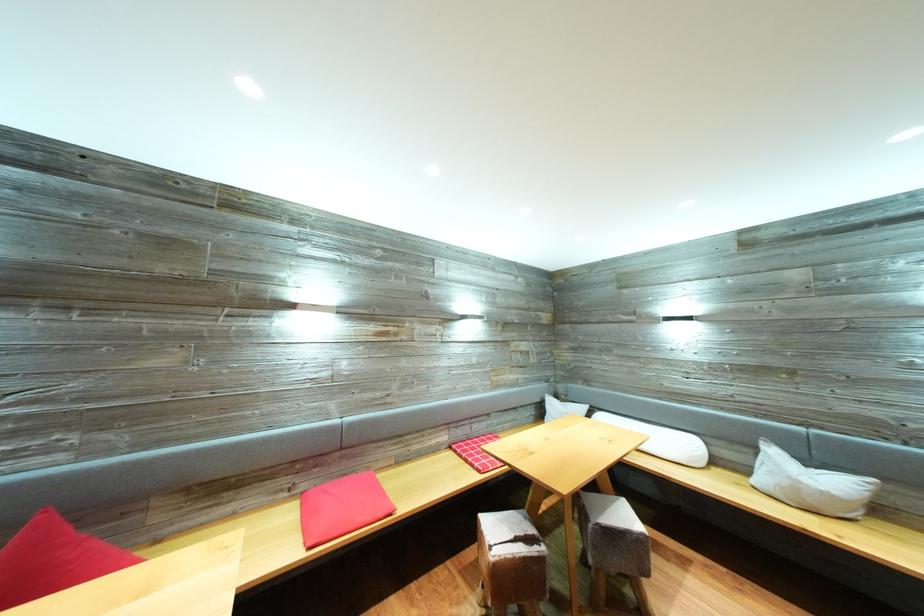
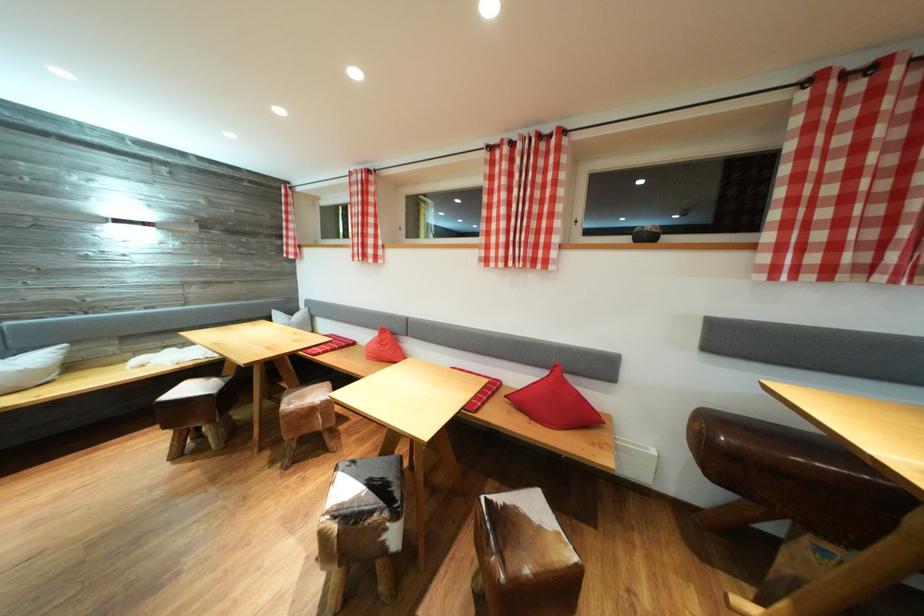
In the second image, find the point that corresponds to pixel 817 468 in the first image.

(14, 358)